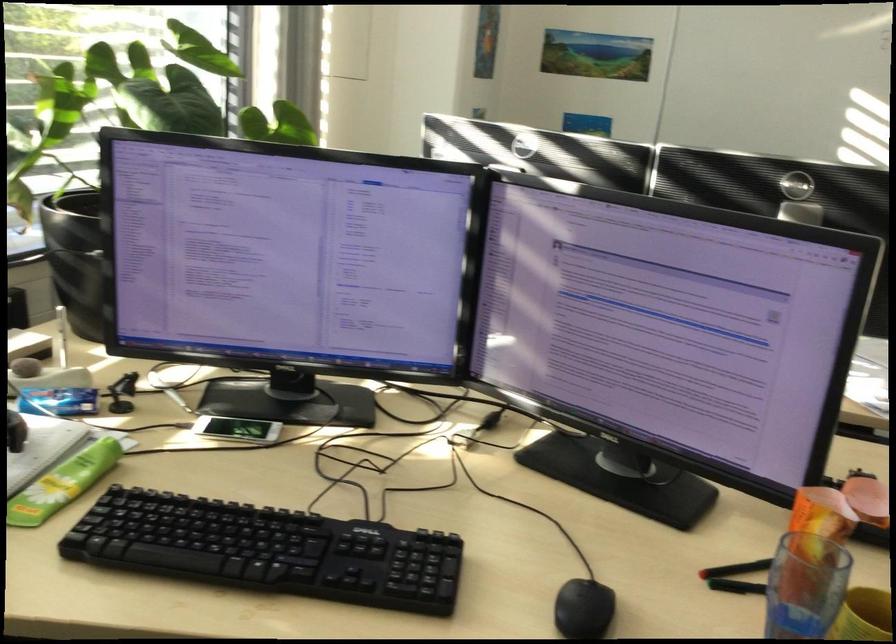
At what (x,y) coordinates should I click in order to perform the action: click on black computer mouse. Please return your answer as a coordinate pair (x, y). Looking at the image, I should click on (583, 609).